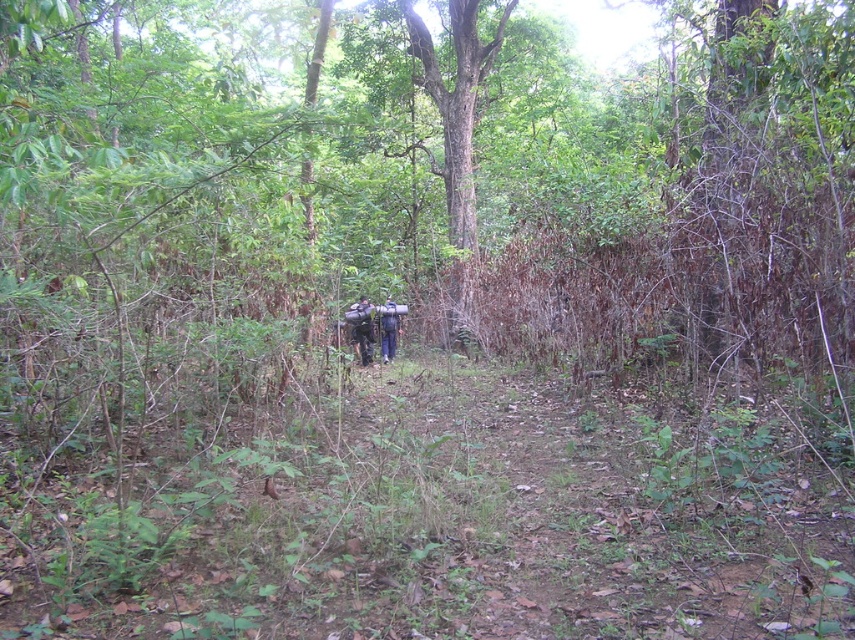
Question: Where is dark green fabric backpack at center located in relation to dark blue fabric backpack at center in the image?

Choices:
 (A) left
 (B) right

Answer: (A)

Question: Which point is closer to the camera?

Choices:
 (A) (369, 333)
 (B) (380, 340)

Answer: (A)

Question: Which object is farther from the camera taking this photo?

Choices:
 (A) dark blue fabric backpack at center
 (B) dark green fabric backpack at center

Answer: (A)

Question: Which point is farther from the camera taking this photo?

Choices:
 (A) (391, 332)
 (B) (367, 330)

Answer: (A)

Question: From the image, what is the correct spatial relationship of dark green fabric backpack at center in relation to dark blue fabric backpack at center?

Choices:
 (A) below
 (B) above

Answer: (B)

Question: Is dark green fabric backpack at center closer to camera compared to dark blue fabric backpack at center?

Choices:
 (A) yes
 (B) no

Answer: (A)